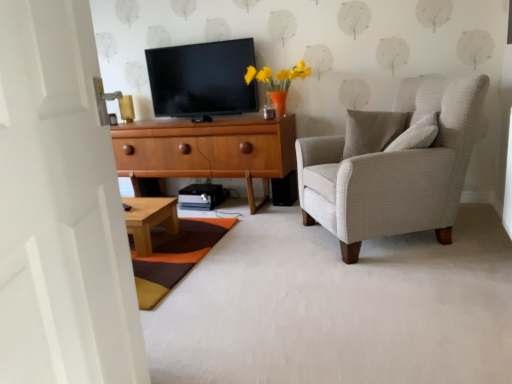
Question: Can you confirm if black glossy tv at upper center is positioned to the left of wooden cabinet at center?

Choices:
 (A) no
 (B) yes

Answer: (A)

Question: Is black glossy tv at upper center directly adjacent to wooden cabinet at center?

Choices:
 (A) yes
 (B) no

Answer: (B)

Question: Is black glossy tv at upper center facing towards wooden cabinet at center?

Choices:
 (A) no
 (B) yes

Answer: (A)

Question: From the image's perspective, is black glossy tv at upper center on wooden cabinet at center?

Choices:
 (A) no
 (B) yes

Answer: (B)

Question: Is black glossy tv at upper center facing away from wooden cabinet at center?

Choices:
 (A) yes
 (B) no

Answer: (B)

Question: Is black glossy tv at upper center thinner than wooden cabinet at center?

Choices:
 (A) no
 (B) yes

Answer: (B)

Question: Does white wooden door at left lie behind multicolored woven mat at lower center?

Choices:
 (A) no
 (B) yes

Answer: (A)

Question: Is there a large distance between white wooden door at left and multicolored woven mat at lower center?

Choices:
 (A) no
 (B) yes

Answer: (B)

Question: Can you confirm if white wooden door at left is bigger than multicolored woven mat at lower center?

Choices:
 (A) yes
 (B) no

Answer: (A)

Question: Can you confirm if white wooden door at left is smaller than multicolored woven mat at lower center?

Choices:
 (A) yes
 (B) no

Answer: (B)

Question: From a real-world perspective, is white wooden door at left below multicolored woven mat at lower center?

Choices:
 (A) yes
 (B) no

Answer: (B)

Question: Can you confirm if white wooden door at left is positioned to the right of multicolored woven mat at lower center?

Choices:
 (A) no
 (B) yes

Answer: (B)

Question: Is the position of multicolored woven mat at lower center less distant than that of light gray fabric armchair at right?

Choices:
 (A) no
 (B) yes

Answer: (B)